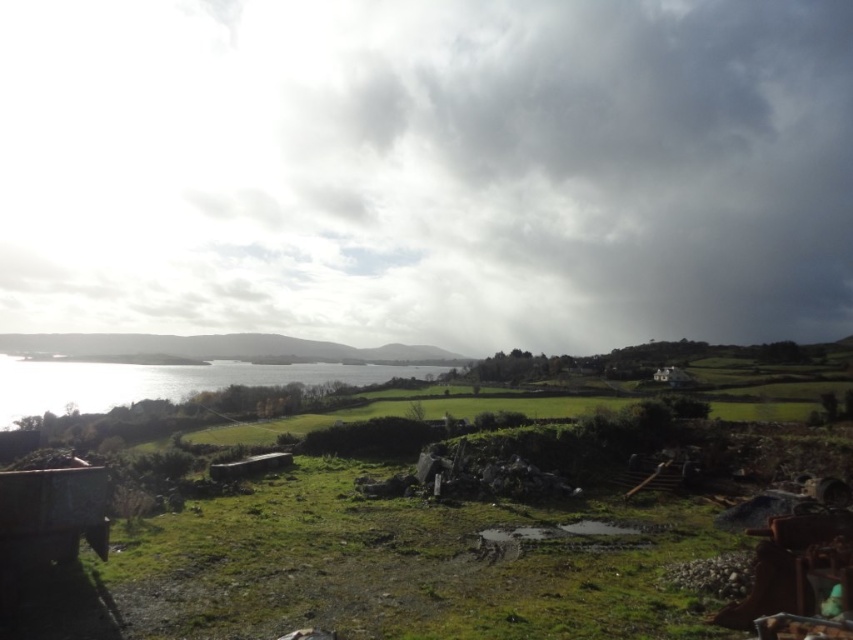
Question: Based on their relative distances, which object is farther from the shiny silver water at left?

Choices:
 (A) cloudy sky at upper center
 (B) green grassy hillside at lower center

Answer: (A)

Question: From the image, what is the correct spatial relationship of cloudy sky at upper center in relation to green grassy hillside at lower center?

Choices:
 (A) above
 (B) below

Answer: (A)

Question: Does cloudy sky at upper center appear on the right side of shiny silver water at left?

Choices:
 (A) yes
 (B) no

Answer: (A)

Question: Does cloudy sky at upper center have a greater width compared to green grassy hillside at lower center?

Choices:
 (A) yes
 (B) no

Answer: (A)

Question: Among these points, which one is nearest to the camera?

Choices:
 (A) (102, 333)
 (B) (283, 368)

Answer: (B)

Question: Which of these objects is positioned closest to the cloudy sky at upper center?

Choices:
 (A) green grassy hillside at lower center
 (B) shiny silver water at left

Answer: (A)